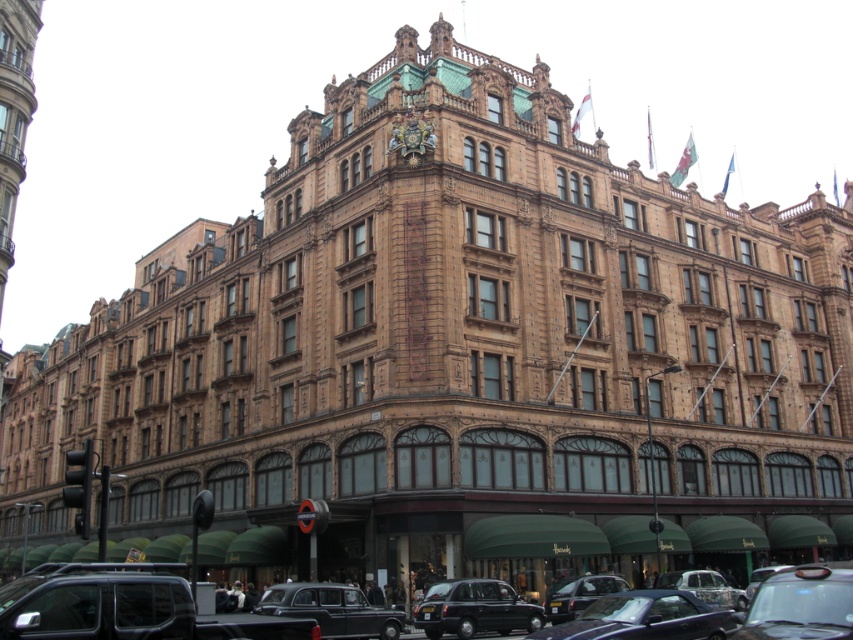
You are a pedestrian standing on the sidewalk in front of the grand ornate building. You see a black polished taxi at lower center and a black metallic car at lower center. Which vehicle is closer to you?

The black polished taxi at lower center is closer to you because it is in front of the black metallic car at lower center.

You are a pedestrian standing on the sidewalk in front of the grand building. You need to cross the street to reach the entrance. There is a black polished taxi at lower center and a black metallic car at lower center blocking your path. Can you walk between them to get to the entrance?

The black polished taxi at lower center and the black metallic car at lower center are 11.25 meters apart from each other, so yes, you can walk between them to get to the entrance since the distance is sufficient for a pedestrian to pass through.